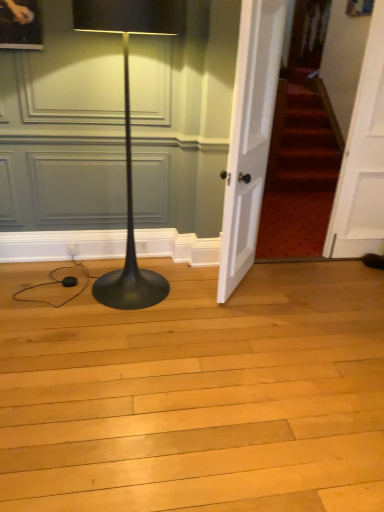
Find the location of a particular element. The height and width of the screenshot is (512, 384). white wooden door at right, the 1th door in the right-to-left sequence is located at coordinates 361,154.

Locate an element on the screen. black glossy floor lamp at left is located at coordinates (130, 133).

What do you see at coordinates (130, 133) in the screenshot?
I see `black glossy floor lamp at left` at bounding box center [130, 133].

The height and width of the screenshot is (512, 384). I want to click on white wooden door at right, the 1th door in the right-to-left sequence, so click(361, 154).

How much distance is there between black glossy floor lamp at left and white wooden door at right, the 1th door in the right-to-left sequence?

5.03 feet.

Is black glossy floor lamp at left placed right next to white wooden door at right, the 1th door in the right-to-left sequence?

No, black glossy floor lamp at left is not with white wooden door at right, the 1th door in the right-to-left sequence.

What are the coordinates of `lamp lying below the white wooden door at right, the second door viewed from the left (from the image's perspective)` in the screenshot? It's located at (130, 133).

From a real-world perspective, is black glossy floor lamp at left under white wooden door at right, the 1th door in the right-to-left sequence?

Yes, from a real-world perspective, black glossy floor lamp at left is below white wooden door at right, the 1th door in the right-to-left sequence.

Considering the relative positions of white wooden door at center, the first door in the left-to-right sequence, and white wooden door at right, the second door viewed from the left, in the image provided, is white wooden door at center, the first door in the left-to-right sequence, in front of white wooden door at right, the second door viewed from the left,?

Yes.

Would you say white wooden door at center, the first door in the left-to-right sequence, is to the left or to the right of white wooden door at right, the second door viewed from the left, in the picture?

From the image, it's evident that white wooden door at center, the first door in the left-to-right sequence, is to the left of white wooden door at right, the second door viewed from the left.

Does point (265, 125) lie behind point (351, 211)?

No, (265, 125) is closer to viewer.

Consider the image. Are black glossy floor lamp at left and white wooden door at center, the first door in the left-to-right sequence, beside each other?

There is a gap between black glossy floor lamp at left and white wooden door at center, the first door in the left-to-right sequence.

From a real-world perspective, does black glossy floor lamp at left stand above white wooden door at center, the second door when ordered from right to left?

Incorrect, from a real-world perspective, black glossy floor lamp at left is lower than white wooden door at center, the second door when ordered from right to left.

Is black glossy floor lamp at left facing towards white wooden door at center, the first door in the left-to-right sequence?

No, black glossy floor lamp at left is not turned towards white wooden door at center, the first door in the left-to-right sequence.

From the image's perspective, between black glossy floor lamp at left and white wooden door at center, the first door in the left-to-right sequence, who is located below?

black glossy floor lamp at left.

From the image's perspective, which object appears higher, white wooden door at right, the 1th door in the right-to-left sequence, or black glossy floor lamp at left?

white wooden door at right, the 1th door in the right-to-left sequence.

Who is bigger, white wooden door at right, the 1th door in the right-to-left sequence, or black glossy floor lamp at left?

Bigger between the two is black glossy floor lamp at left.

Does white wooden door at right, the 1th door in the right-to-left sequence, lie behind black glossy floor lamp at left?

Yes, white wooden door at right, the 1th door in the right-to-left sequence, is behind black glossy floor lamp at left.

In the image, is white wooden door at right, the 1th door in the right-to-left sequence, on the left side or the right side of white wooden door at center, the first door in the left-to-right sequence?

From the image, it's evident that white wooden door at right, the 1th door in the right-to-left sequence, is to the right of white wooden door at center, the first door in the left-to-right sequence.

In terms of width, does white wooden door at right, the second door viewed from the left, look wider or thinner when compared to white wooden door at center, the first door in the left-to-right sequence?

Considering their sizes, white wooden door at right, the second door viewed from the left, looks slimmer than white wooden door at center, the first door in the left-to-right sequence.

What's the angular difference between white wooden door at right, the second door viewed from the left, and white wooden door at center, the second door when ordered from right to left,'s facing directions?

54.1 degrees separate the facing orientations of white wooden door at right, the second door viewed from the left, and white wooden door at center, the second door when ordered from right to left.

Locate an element on the screen. door below the white wooden door at right, the 1th door in the right-to-left sequence (from a real-world perspective) is located at coordinates (249, 136).

Is white wooden door at center, the second door when ordered from right to left, aimed at black glossy floor lamp at left?

No.

Does white wooden door at center, the second door when ordered from right to left, have a smaller size compared to black glossy floor lamp at left?

Indeed, white wooden door at center, the second door when ordered from right to left, has a smaller size compared to black glossy floor lamp at left.

Is point (233, 199) behind point (121, 306)?

No.

Does white wooden door at center, the second door when ordered from right to left, have a greater height compared to black glossy floor lamp at left?

Yes.

You are a GUI agent. You are given a task and a screenshot of the screen. Output one action in this format:
    pyautogui.click(x=<x>, y=<y>)
    Task: Click on the lamp below the white wooden door at right, the 1th door in the right-to-left sequence (from the image's perspective)
    
    Given the screenshot: What is the action you would take?
    pyautogui.click(x=130, y=133)

Where is `door lying above the white wooden door at center, the second door when ordered from right to left (from the image's perspective)`? door lying above the white wooden door at center, the second door when ordered from right to left (from the image's perspective) is located at coordinates (361, 154).

Based on their spatial positions, is white wooden door at right, the 1th door in the right-to-left sequence, or white wooden door at center, the first door in the left-to-right sequence, closer to black glossy floor lamp at left?

white wooden door at center, the first door in the left-to-right sequence.

Estimate the real-world distances between objects in this image. Which object is further from black glossy floor lamp at left, white wooden door at center, the first door in the left-to-right sequence, or white wooden door at right, the second door viewed from the left?

The object further to black glossy floor lamp at left is white wooden door at right, the second door viewed from the left.

Considering their positions, is black glossy floor lamp at left positioned further to white wooden door at center, the first door in the left-to-right sequence, than white wooden door at right, the second door viewed from the left?

white wooden door at right, the second door viewed from the left, is further to white wooden door at center, the first door in the left-to-right sequence.

From the image, which object appears to be nearer to white wooden door at center, the first door in the left-to-right sequence, white wooden door at right, the 1th door in the right-to-left sequence, or black glossy floor lamp at left?

black glossy floor lamp at left lies closer to white wooden door at center, the first door in the left-to-right sequence, than the other object.

When comparing their distances from white wooden door at right, the second door viewed from the left, does white wooden door at center, the first door in the left-to-right sequence, or black glossy floor lamp at left seem closer?

The object closer to white wooden door at right, the second door viewed from the left, is white wooden door at center, the first door in the left-to-right sequence.

Considering their positions, is black glossy floor lamp at left positioned closer to white wooden door at right, the 1th door in the right-to-left sequence, than white wooden door at center, the second door when ordered from right to left?

Based on the image, white wooden door at center, the second door when ordered from right to left, appears to be nearer to white wooden door at right, the 1th door in the right-to-left sequence.

You are a GUI agent. You are given a task and a screenshot of the screen. Output one action in this format:
    pyautogui.click(x=<x>, y=<y>)
    Task: Click on the door between black glossy floor lamp at left and white wooden door at right, the 1th door in the right-to-left sequence
    The width and height of the screenshot is (384, 512).
    Given the screenshot: What is the action you would take?
    pyautogui.click(x=249, y=136)